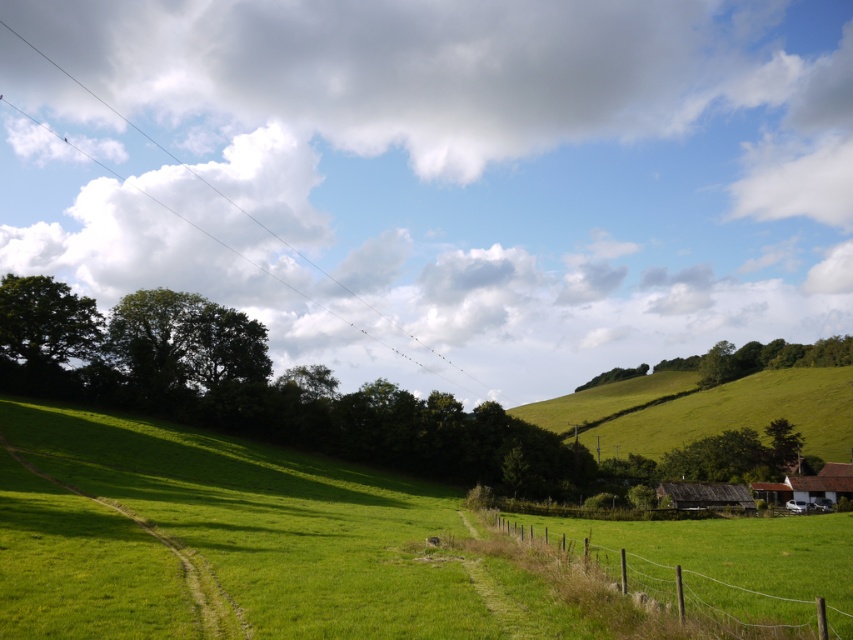
You are standing at the dirt path in the foreground and want to reach the green grassy hillside at center. Which direction should you walk to avoid the wire mesh fence at lower right?

Since the wire mesh fence at lower right is in front of the green grassy hillside at center, you should walk towards the left to bypass the fence and reach the hillside.

You are a landscape architect designing a new park. You need to place a 2.5 meter wide bench between the wire mesh fence at lower right and the green grassy hillside at center. Can the bench fit between them without overlapping either object?

The wire mesh fence at lower right is narrower than the green grassy hillside at center. However, the description only provides information about their widths, not the distance between them. Without knowing the space between the two objects, it is impossible to determine if the bench will fit.